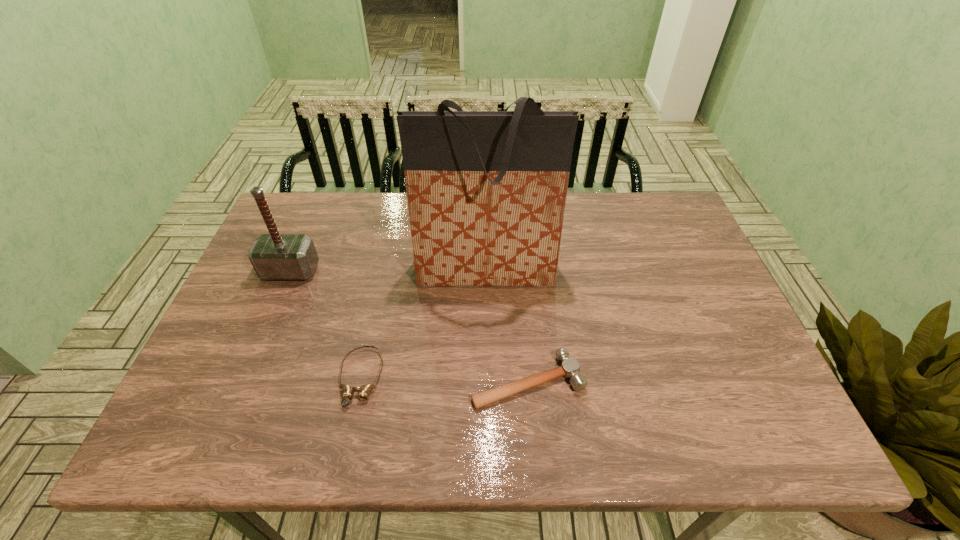
Find the location of a particular element. The height and width of the screenshot is (540, 960). free location that satisfies the following two spatial constraints: 1. on the front lenses and sides of the shortest object; 2. on the left side of the nearer hammer is located at coordinates (360, 381).

The image size is (960, 540). I want to click on vacant space that satisfies the following two spatial constraints: 1. on the front lenses and sides of the third object from right to left; 2. on the right side of the nearer hammer, so click(x=360, y=381).

Where is `free space that satisfies the following two spatial constraints: 1. on the front lenses and sides of the shortest object; 2. on the left side of the third tallest object`? This screenshot has height=540, width=960. free space that satisfies the following two spatial constraints: 1. on the front lenses and sides of the shortest object; 2. on the left side of the third tallest object is located at coordinates (360, 381).